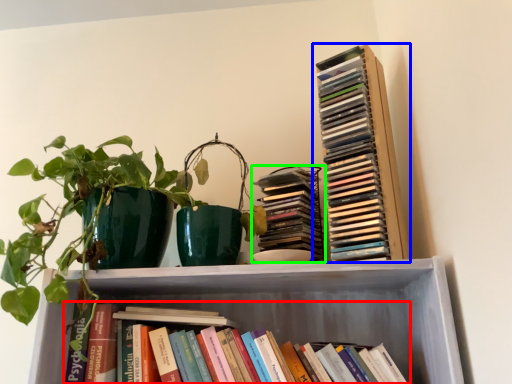
Question: Which is nearer to the book (highlighted by a red box)? book (highlighted by a blue box) or book (highlighted by a green box).

Choices:
 (A) book
 (B) book

Answer: (B)